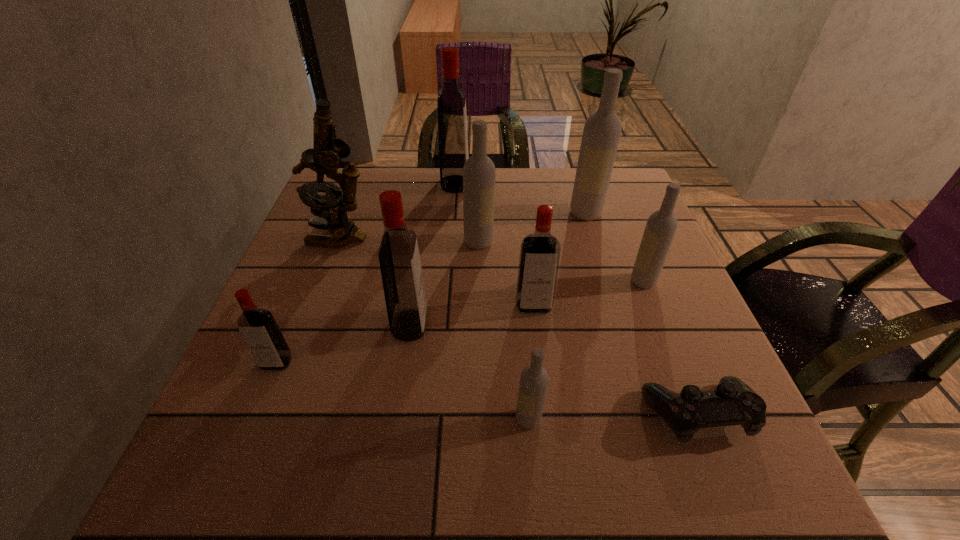
Locate an element on the screen. Image resolution: width=960 pixels, height=540 pixels. free point that satisfies the following two spatial constraints: 1. on the front and back of the farthest red vodka; 2. on the left side of the nearest white vodka is located at coordinates [437, 419].

At what (x,y) coordinates should I click in order to perform the action: click on vacant space that satisfies the following two spatial constraints: 1. on the front and back of the third smallest red vodka; 2. on the back side of the nearest vodka. Please return your answer as a coordinate pair (x, y). The height and width of the screenshot is (540, 960). Looking at the image, I should click on (396, 419).